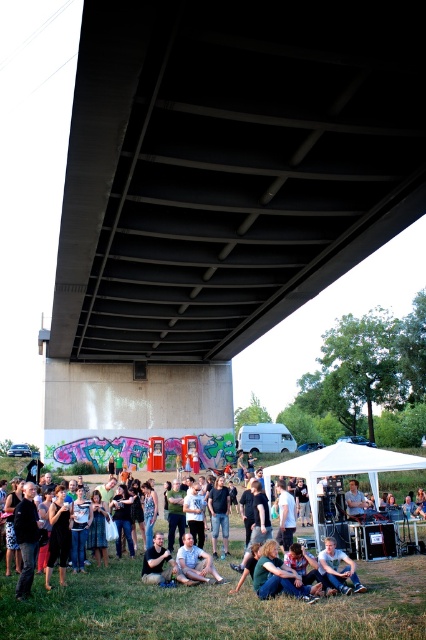
You are organizing a picnic and need to decide whether the white fabric tent at center can accommodate a group of people wearing the green fabric shirt at lower center. Based on the scene description, can the tent fit the group comfortably?

The white fabric tent at center is larger in size than the green fabric shirt at lower center, so the tent should be able to accommodate the group comfortably.

You are a photographer standing at the camera position. You want to capture a closeup shot of the denim jeans at lower center without moving your position. Do you think your camera with a 100mm lens can achieve this? The camera has a sensor size of 24mm x 36mm and the denim jeans are 0.5 meters tall.

The denim jeans at lower center is 32.42 feet away from the camera. Using the lens formula, the minimum focusing distance for a 100mm lens with a 24x36mm sensor would require the subject to be at least 32.42 feet away to capture a 0.5m tall object. Therefore, the camera can achieve the closeup shot.

You are standing at the entrance of the bridge and want to locate the white fabric tent at center. According to the coordinates provided, in which direction should you move to reach it?

The white fabric tent at center is located at coordinates point (340,468). Since you are at the entrance of the bridge, you should move forward towards the center of the bridge to reach it.